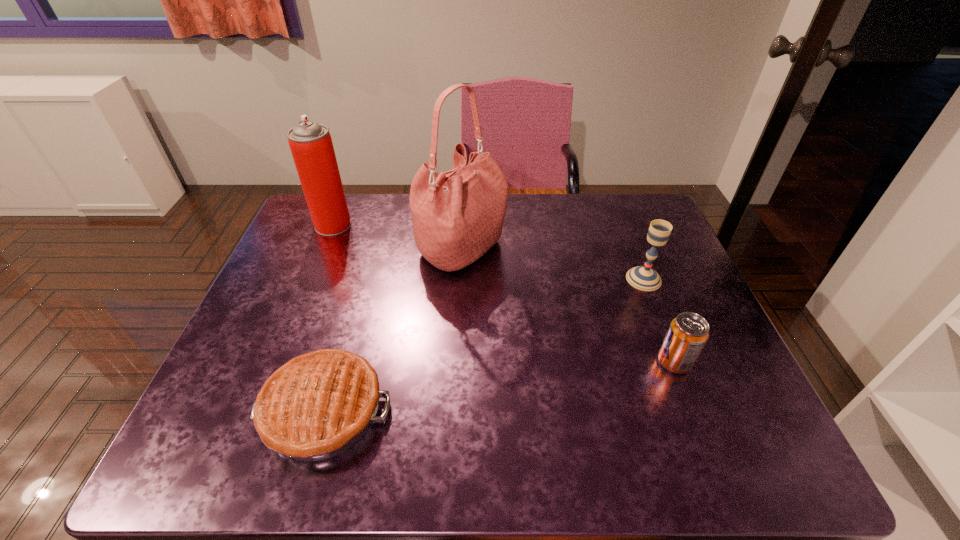
Identify the location of vacant space at the far edge of the desktop. This screenshot has height=540, width=960. (547, 194).

In the image, there is a desktop. Where is `vacant region at the near edge`? vacant region at the near edge is located at coordinates (483, 435).

What are the coordinates of `vacant space at the left edge of the desktop` in the screenshot? It's located at tap(282, 263).

Locate an element on the screen. The width and height of the screenshot is (960, 540). vacant space at the right edge of the desktop is located at coordinates (657, 261).

The width and height of the screenshot is (960, 540). In order to click on vacant region at the near right corner of the desktop in this screenshot , I will do `click(767, 427)`.

Where is `vacant space that's between the chalice and the shortest object`? This screenshot has width=960, height=540. vacant space that's between the chalice and the shortest object is located at coordinates (484, 345).

The width and height of the screenshot is (960, 540). I want to click on free space between the third tallest object and the third object from right to left, so (553, 265).

Identify the location of vacant point located between the soda can and the aerosol can. (504, 293).

At what (x,y) coordinates should I click in order to perform the action: click on vacant area that lies between the fourth shortest object and the third tallest object. Please return your answer as a coordinate pair (x, y). The image size is (960, 540). Looking at the image, I should click on (489, 252).

Locate an element on the screen. free space between the handbag and the shortest object is located at coordinates (394, 330).